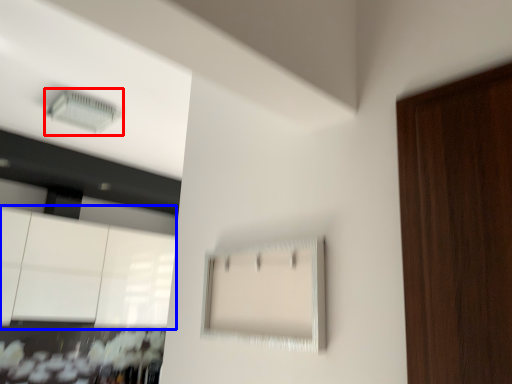
Question: Which object appears closest to the camera in this image, air conditioning (highlighted by a red box) or cabinetry (highlighted by a blue box)?

Choices:
 (A) air conditioning
 (B) cabinetry

Answer: (A)